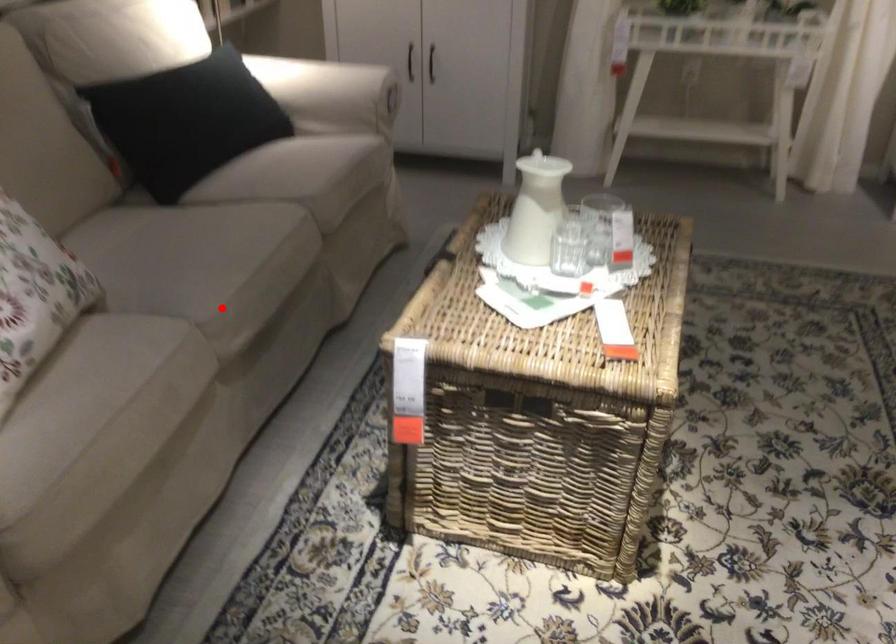
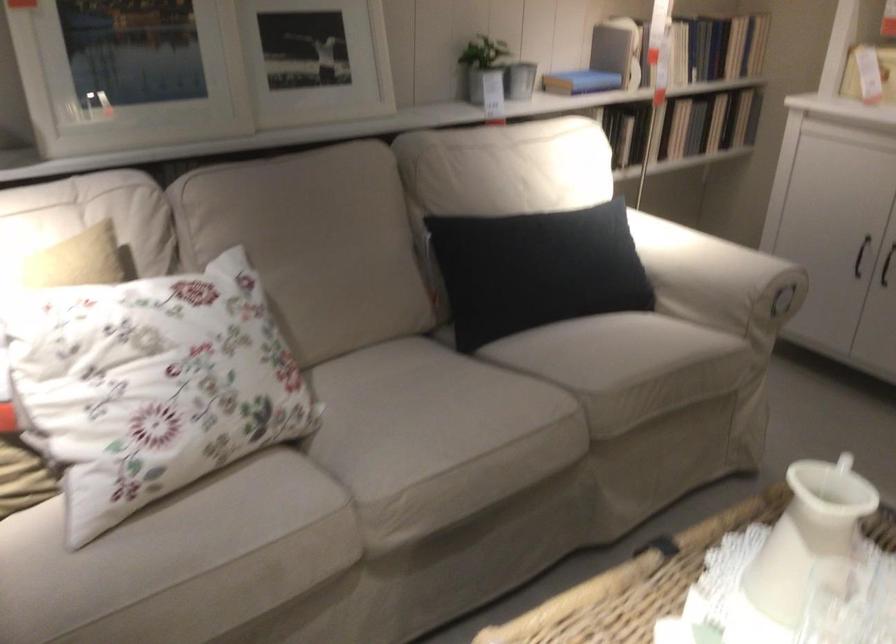
Question: I am providing you with two images of the same scene from different viewpoints. A red point is marked on the first image. Can you still see the location of the red point in image 2?

Choices:
 (A) Yes
 (B) No

Answer: (A)